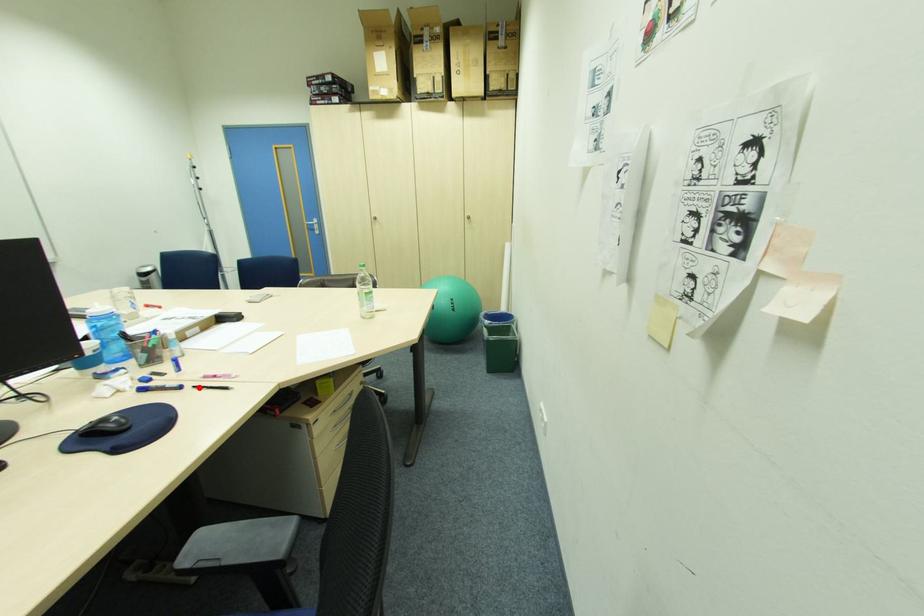
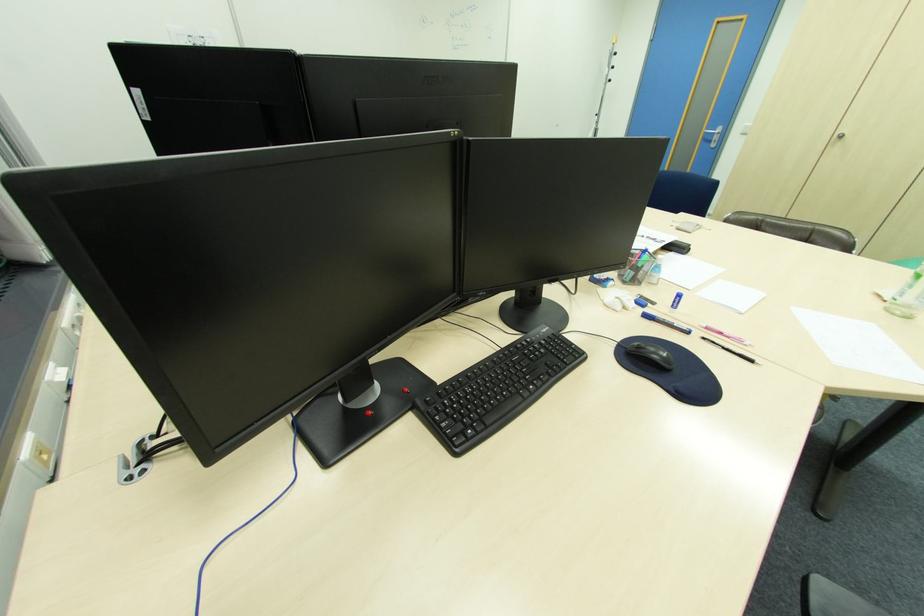
In the second image, find the point that corresponds to the highlighted location in the first image.

(709, 339)